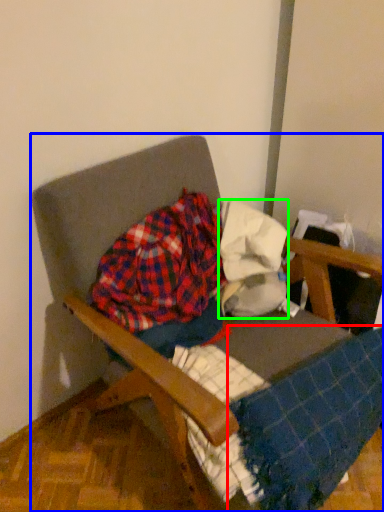
Question: Estimate the real-world distances between objects in this image. Which object is closer to blanket (highlighted by a red box), chair (highlighted by a blue box) or fabric (highlighted by a green box)?

Choices:
 (A) chair
 (B) fabric

Answer: (B)